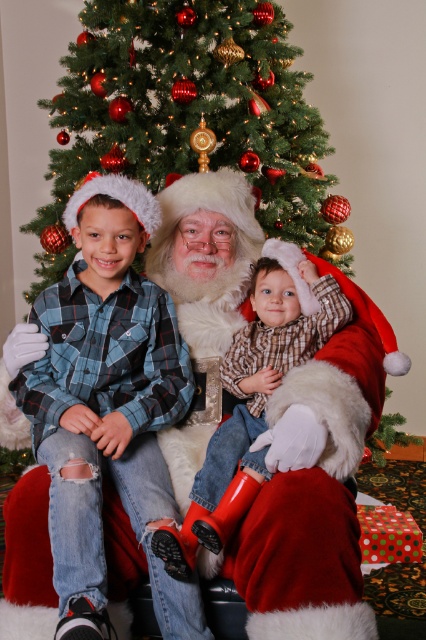
Is point (46, 348) farther from camera compared to point (310, 456)?

Yes, point (46, 348) is farther from viewer.

Is point (138, 392) closer to viewer compared to point (218, 568)?

No, it is behind (218, 568).

Find the location of `blue plaid shirt at center`. blue plaid shirt at center is located at coordinates (108, 404).

Is blue plaid shirt at center to the left of green textured christmas tree at upper center from the viewer's perspective?

Yes, blue plaid shirt at center is to the left of green textured christmas tree at upper center.

Between blue plaid shirt at center and green textured christmas tree at upper center, which one has more height?

green textured christmas tree at upper center is taller.

I want to click on blue plaid shirt at center, so click(108, 404).

This screenshot has width=426, height=640. Identify the location of blue plaid shirt at center. (108, 404).

Does green textured christmas tree at upper center appear under plaid flannel shirt at center?

Actually, green textured christmas tree at upper center is above plaid flannel shirt at center.

Can you confirm if green textured christmas tree at upper center is shorter than plaid flannel shirt at center?

Incorrect, green textured christmas tree at upper center's height does not fall short of plaid flannel shirt at center's.

Describe the element at coordinates (184, 112) in the screenshot. This screenshot has width=426, height=640. I see `green textured christmas tree at upper center` at that location.

Locate an element on the screen. green textured christmas tree at upper center is located at coordinates (184, 112).